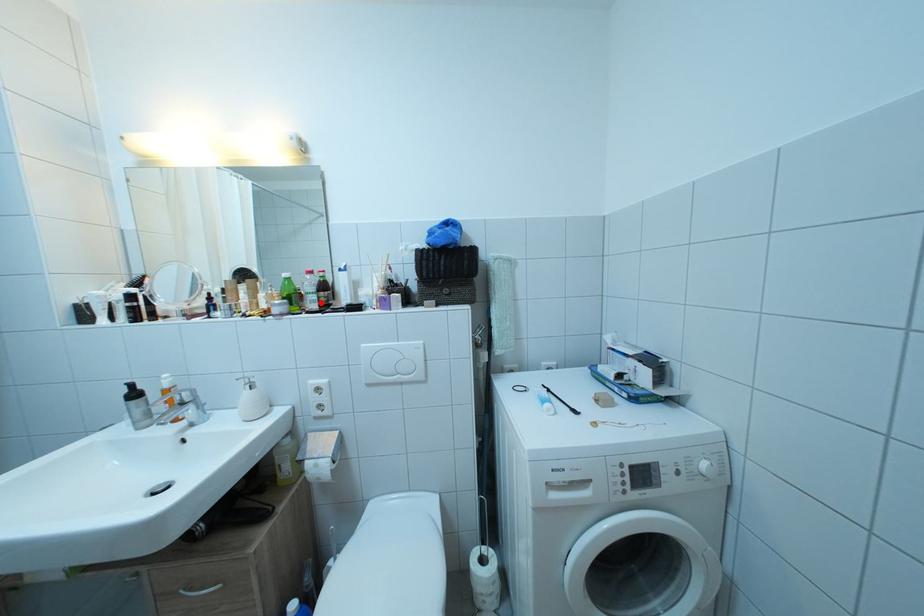
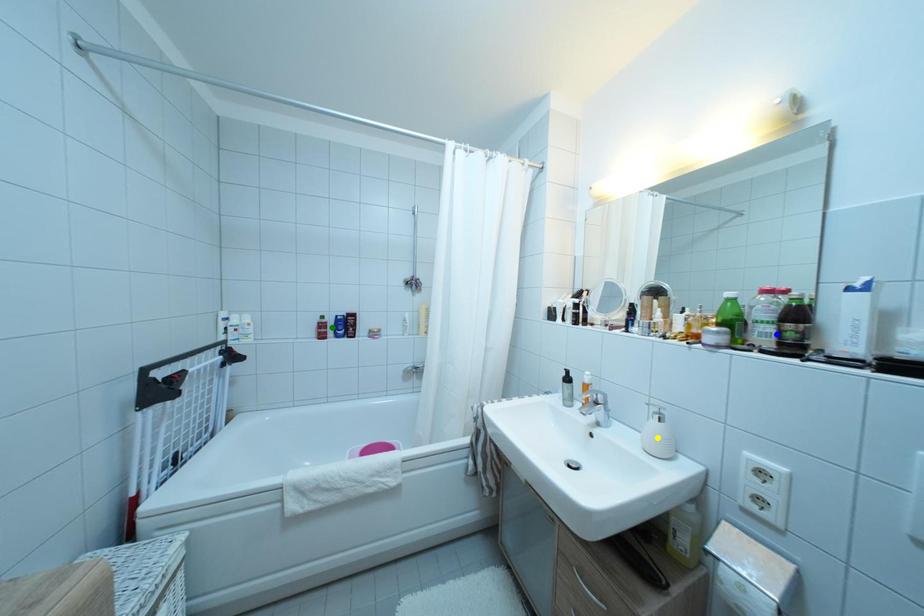
Question: I am providing you with two images of the same scene from different viewpoints. A red point is marked on the first image. You are given multiple points on the second image. Can you choose the point in image 2 that corresponds to the point in image 1?

Choices:
 (A) green point
 (B) blue point
 (C) yellow point

Answer: (B)